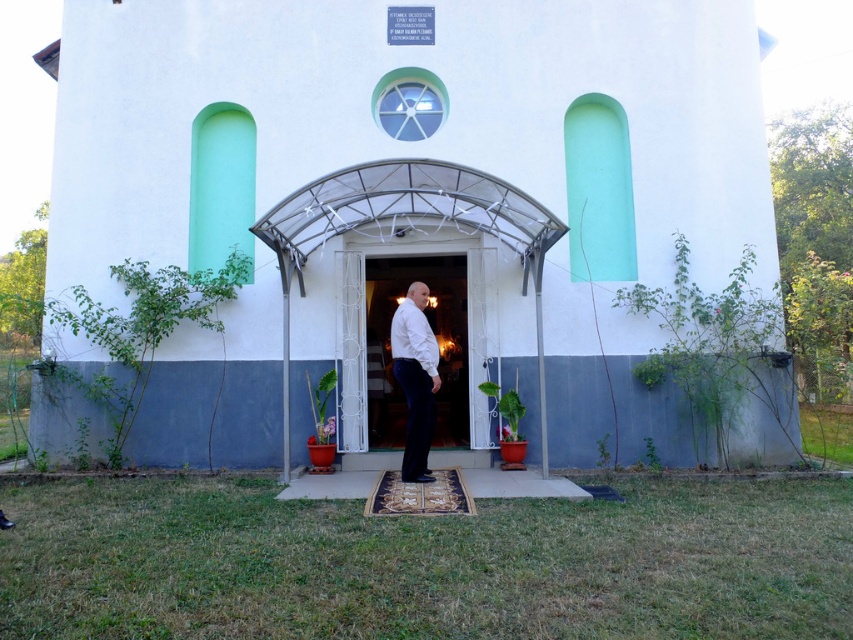
Question: Which object appears farthest from the camera in this image?

Choices:
 (A) white matte shirt at center
 (B) white matte chapel at center
 (C) white wooden door at center

Answer: (C)

Question: In this image, where is white wooden door at center located relative to white matte shirt at center?

Choices:
 (A) above
 (B) below

Answer: (A)

Question: Among these points, which one is nearest to the camera?

Choices:
 (A) (457, 282)
 (B) (424, 380)
 (C) (618, 3)

Answer: (B)

Question: Does white wooden door at center appear over white matte shirt at center?

Choices:
 (A) no
 (B) yes

Answer: (B)

Question: Observing the image, what is the correct spatial positioning of white matte chapel at center in reference to white matte shirt at center?

Choices:
 (A) right
 (B) left

Answer: (B)

Question: Which is farther from the white matte chapel at center?

Choices:
 (A) white wooden door at center
 (B) white matte shirt at center

Answer: (B)